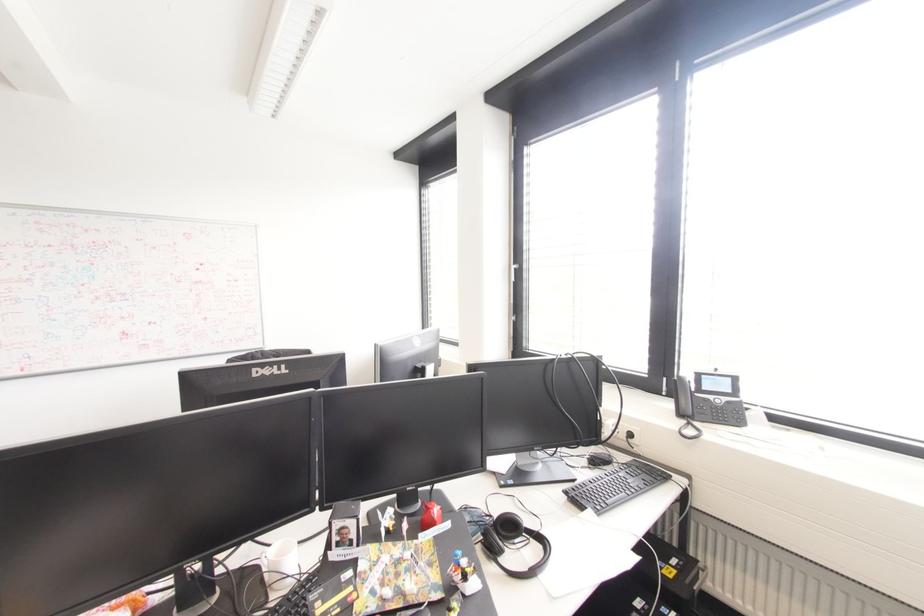
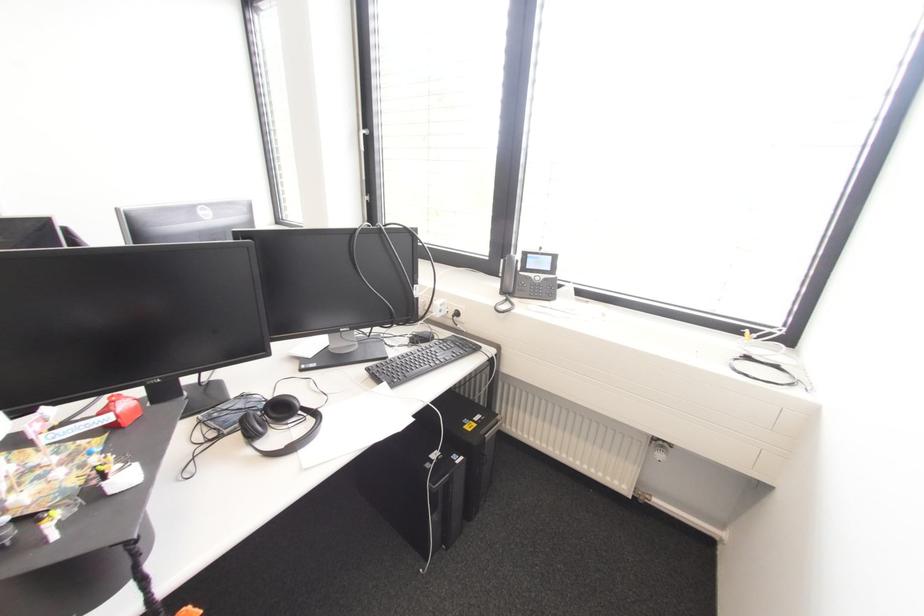
First-person continuous shooting, in which direction is the camera rotating?

The rotation direction of the camera is right-down.